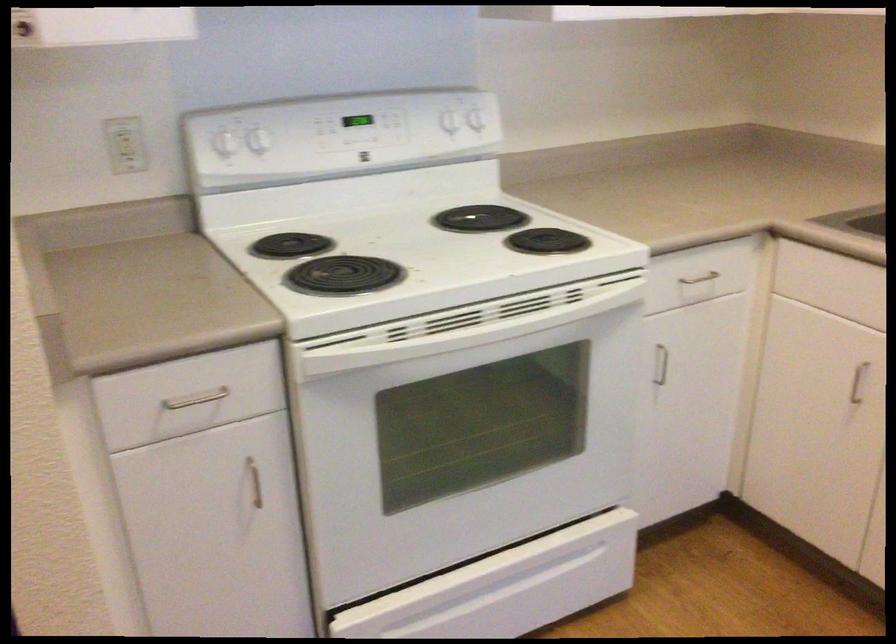
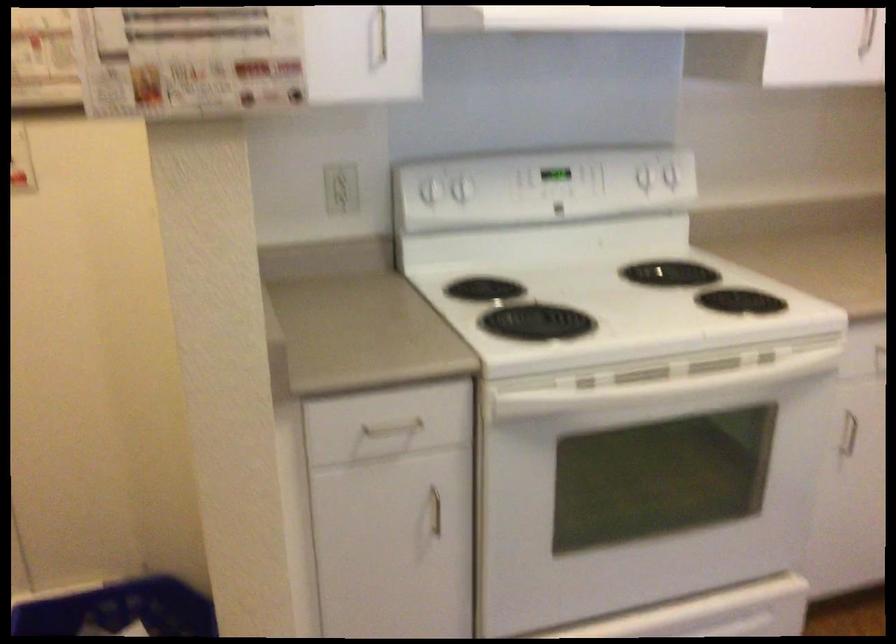
Question: Based on the continuous images, in which direction is the camera rotating? Reply with the corresponding letter.

Choices:
 (A) Left
 (B) Right
 (C) Up
 (D) Down

Answer: (A)